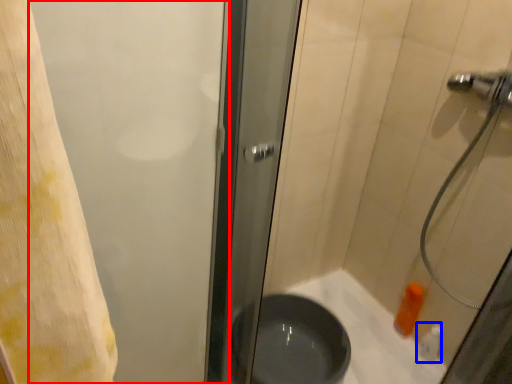
Question: Among these objects, which one is farthest to the camera, screen door (highlighted by a red box) or toiletry (highlighted by a blue box)?

Choices:
 (A) screen door
 (B) toiletry

Answer: (B)